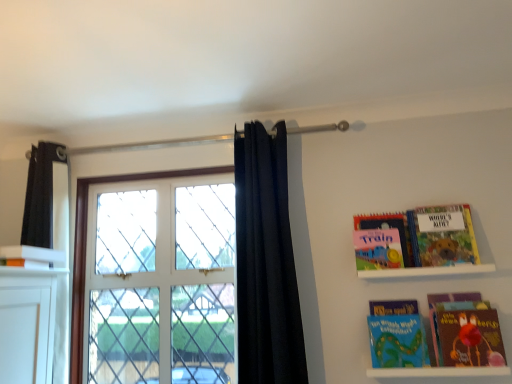
Question: Considering the relative positions of matte pink book at upper right, the third book in the right-to-left sequence, and hardcover book at upper right, which appears as the 4th book when viewed from the left, in the image provided, is matte pink book at upper right, the third book in the right-to-left sequence, to the left or to the right of hardcover book at upper right, which appears as the 4th book when viewed from the left,?

Choices:
 (A) left
 (B) right

Answer: (A)

Question: In terms of size, does matte pink book at upper right, placed as the 2th book when sorted from left to right, appear bigger or smaller than hardcover book at upper right, which appears as the 4th book when viewed from the left?

Choices:
 (A) small
 (B) big

Answer: (A)

Question: Estimate the real-world distances between objects in this image. Which object is farther from the matte red book at lower right?

Choices:
 (A) white glass window at center
 (B) black fabric curtain at center
 (C) white matte shelf at lower right, the 2th shelf in the top-to-bottom sequence
 (D) white glossy book at upper left, which appears as the 1th book when viewed from the left
 (E) white matte shelf at upper right, acting as the second shelf starting from the bottom

Answer: (D)

Question: Which object is the closest to the white glass window at center?

Choices:
 (A) matte pink book at upper right, the third book in the right-to-left sequence
 (B) matte red book at lower right
 (C) white matte shelf at upper right, the 1th shelf viewed from the top
 (D) blue matte bookshelf at lower right, the second book viewed from the right
 (E) white glossy book at upper left, which appears as the 1th book when viewed from the left

Answer: (E)